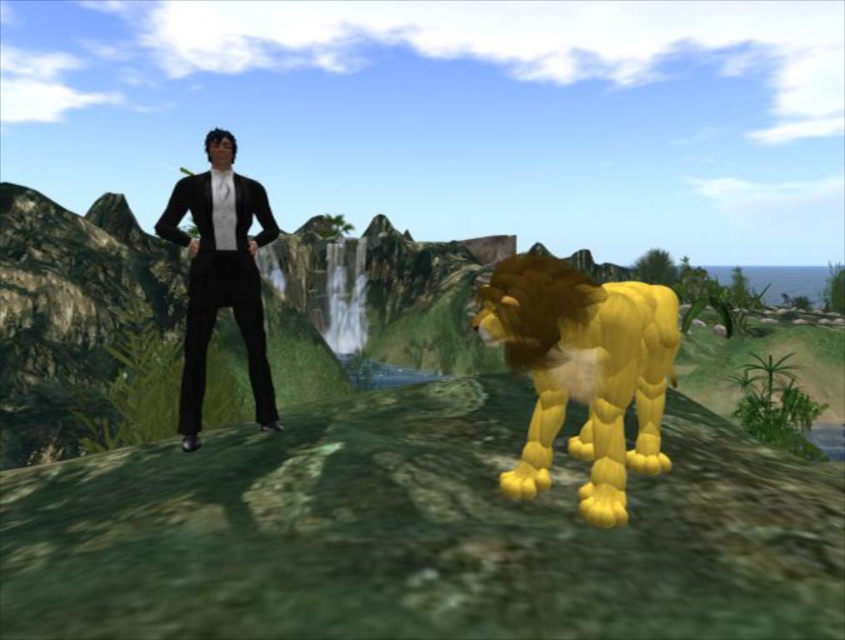
You are observing the image from the front. Which of the two points, point (x=581, y=321) or point (x=194, y=248), is positioned closer to your viewpoint?

Point (x=581, y=321) is closer to the camera than point (x=194, y=248), so it is positioned closer to your viewpoint.

You are an artist analyzing the surreal scene. You notice the yellow matte lion at center and the black glossy suit at center. Which object appears bigger in the image?

The yellow matte lion at center is larger in size than the black glossy suit at center.

You are a photographer setting up for a photo shoot in the tropical landscape. You want to capture the yellow matte lion at center in focus while keeping the human figure in the background blurred. Given the camera settings, what is the minimum distance you should place between the lion and the human figure?

The yellow matte lion at center is 2.01 meters from the camera. To ensure the lion is in focus and the human figure in the background is blurred, the human figure should be placed at least 2 meters away from the lion. This creates sufficient distance between the subject and background for depth of field effects.